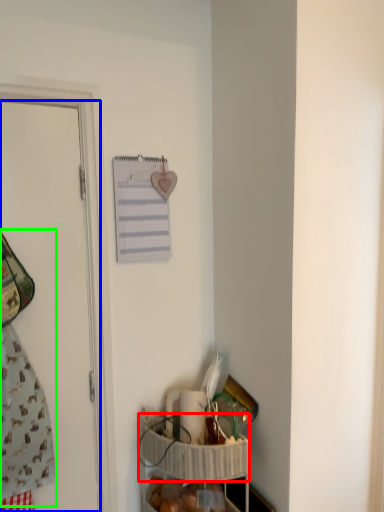
Question: Based on their relative distances, which object is farther from basket (highlighted by a red box)? Choose from door (highlighted by a blue box) and laundry (highlighted by a green box).

Choices:
 (A) door
 (B) laundry

Answer: (B)